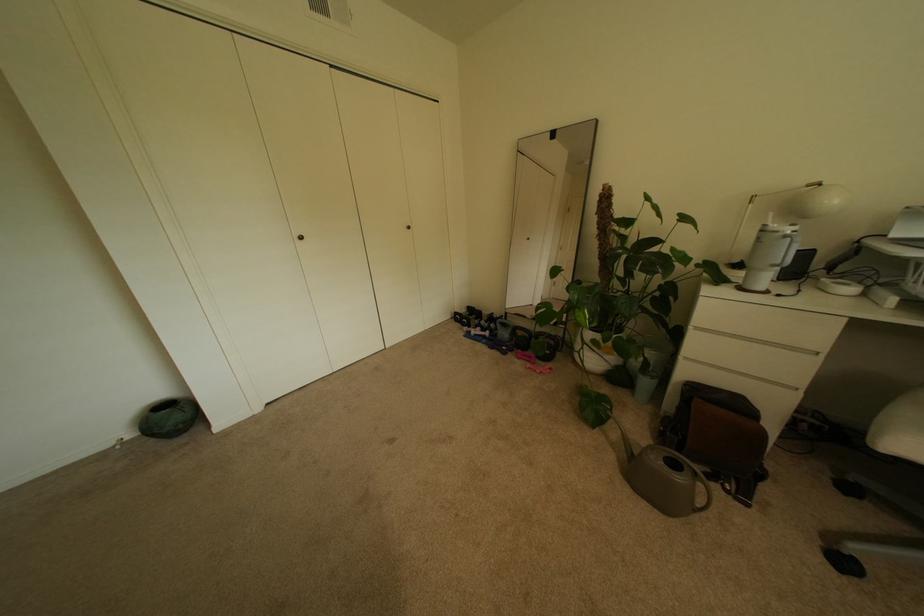
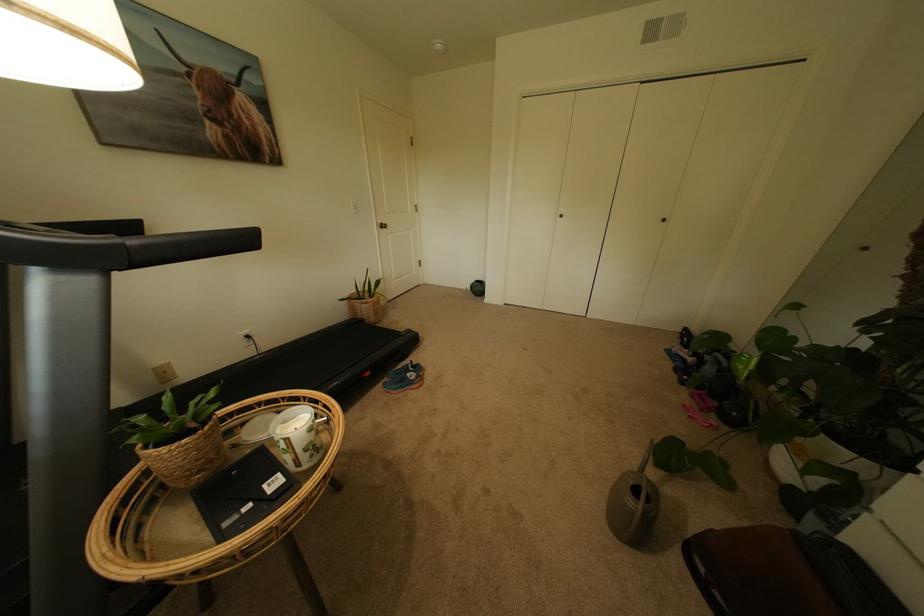
The point at (x=672, y=464) is marked in the first image. Where is the corresponding point in the second image?

(639, 484)